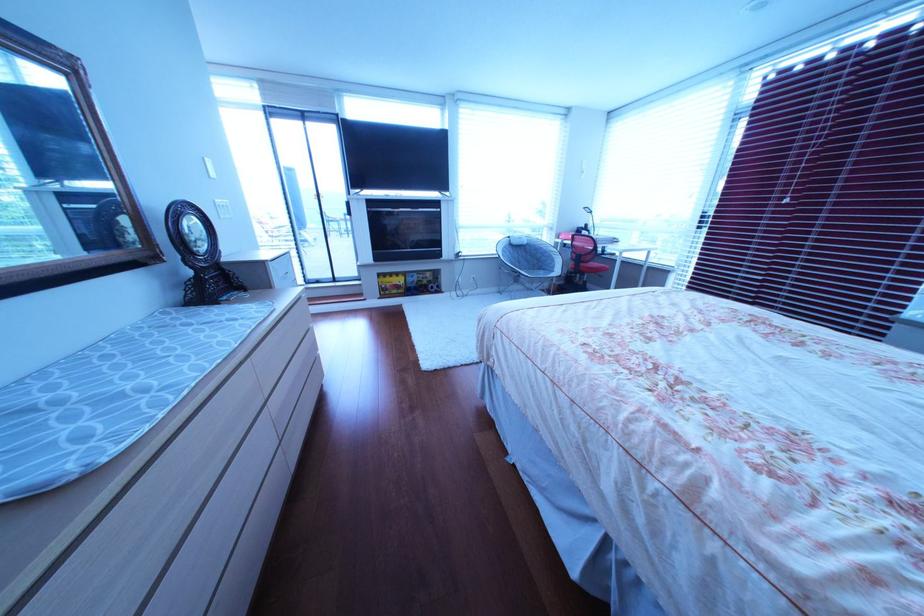
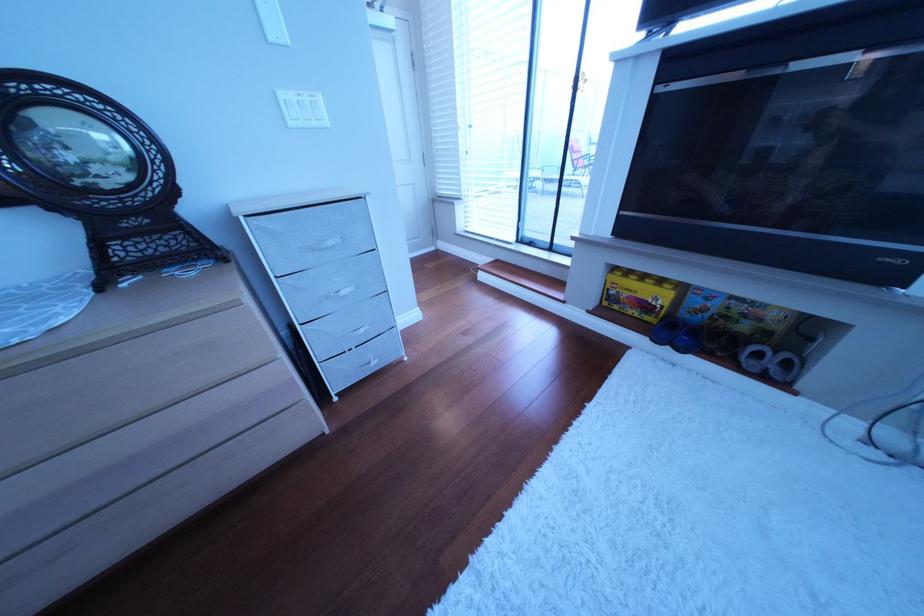
Where in the second image is the point corresponding to the point at 419,292 from the first image?

(672, 320)